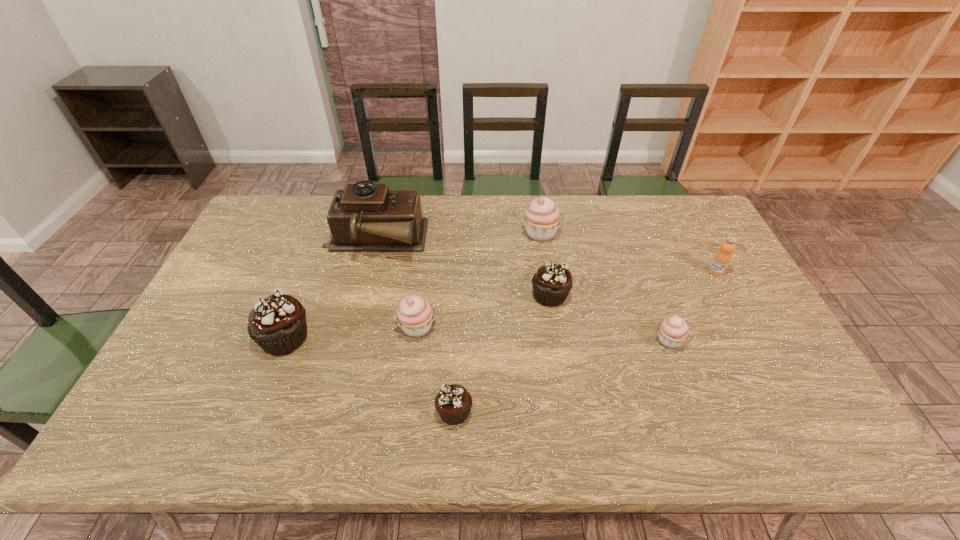
You are a GUI agent. You are given a task and a screenshot of the screen. Output one action in this format:
    pyautogui.click(x=<x>, y=<y>)
    Task: Click on the blank region between the second pink cupcake from right to left and the orange juice
    Image resolution: width=960 pixels, height=540 pixels.
    Given the screenshot: What is the action you would take?
    pyautogui.click(x=628, y=253)

Locate an element on the screen. This screenshot has width=960, height=540. vacant space in between the tallest object and the fifth cupcake from right to left is located at coordinates (396, 284).

Where is `free space between the second biggest brown cupcake and the rightmost pink cupcake`? free space between the second biggest brown cupcake and the rightmost pink cupcake is located at coordinates point(610,318).

Where is `free space between the farthest cupcake and the third farthest object`? free space between the farthest cupcake and the third farthest object is located at coordinates (628, 253).

Where is `vacant point located between the second farthest brown cupcake and the tallest object`? The height and width of the screenshot is (540, 960). vacant point located between the second farthest brown cupcake and the tallest object is located at coordinates pyautogui.click(x=330, y=289).

This screenshot has height=540, width=960. What are the coordinates of `vacant area that lies between the orange juice and the phonograph_record` in the screenshot? It's located at (545, 256).

The height and width of the screenshot is (540, 960). I want to click on free space between the second pink cupcake from left to right and the fourth object from left to right, so click(x=497, y=322).

The height and width of the screenshot is (540, 960). I want to click on vacant space in between the farthest brown cupcake and the second pink cupcake from right to left, so click(x=545, y=265).

Locate which object ranks sixth in proximity to the leftmost brown cupcake. Please provide its 2D coordinates. Your answer should be formatted as a tuple, i.e. [(x, y)], where the tuple contains the x and y coordinates of a point satisfying the conditions above.

[(673, 331)]

Locate an element on the screen. Image resolution: width=960 pixels, height=540 pixels. object that can be found as the third closest to the second object from right to left is located at coordinates (542, 217).